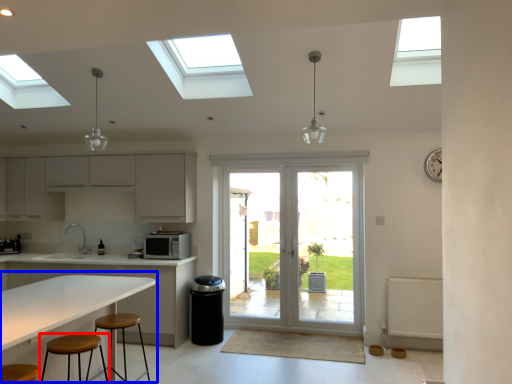
Question: Which object is closer to the camera taking this photo, stool (highlighted by a red box) or table (highlighted by a blue box)?

Choices:
 (A) stool
 (B) table

Answer: (B)